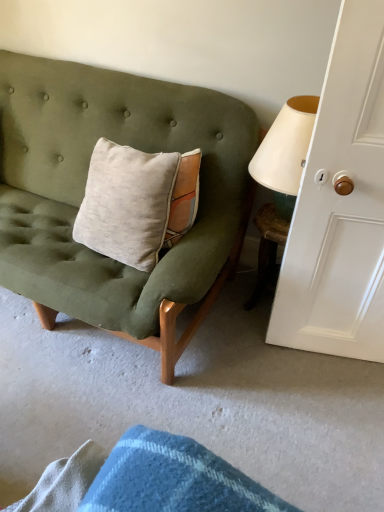
Question: From the image's perspective, is white painted wood door at right above or below wooden table at lower right?

Choices:
 (A) below
 (B) above

Answer: (B)

Question: Considering the positions of white painted wood door at right and wooden table at lower right in the image, is white painted wood door at right bigger or smaller than wooden table at lower right?

Choices:
 (A) small
 (B) big

Answer: (B)

Question: Estimate the real-world distances between objects in this image. Which object is farther from the wooden table at lower right?

Choices:
 (A) matte green fabric couch at left
 (B) white painted wood door at right

Answer: (A)

Question: Which object is the closest to the white painted wood door at right?

Choices:
 (A) wooden table at lower right
 (B) matte green fabric couch at left

Answer: (A)